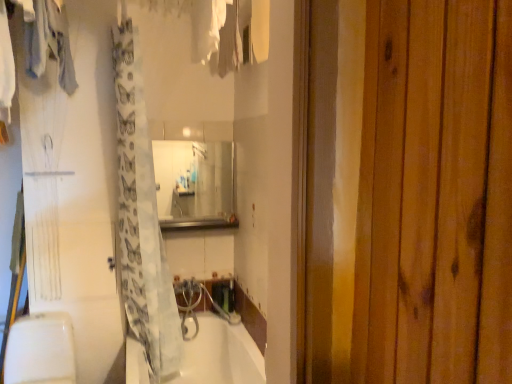
Question: In the image, is translucent white shower curtain at center on the left side or the right side of metallic stainless steel at center?

Choices:
 (A) left
 (B) right

Answer: (A)

Question: Choose the correct answer: Is translucent white shower curtain at center inside metallic stainless steel at center or outside it?

Choices:
 (A) outside
 (B) inside

Answer: (A)

Question: Estimate the real-world distances between objects in this image. Which object is farther from the white glossy bathtub at lower center?

Choices:
 (A) light gray fabric at upper left, acting as the 2th clothing starting from the right
 (B) clear glass mirror at center
 (C) metallic stainless steel at center
 (D) white fabric at upper center, which appears as the 1th clothing when viewed from the right
 (E) translucent white shower curtain at center

Answer: (D)

Question: Considering the real-world distances, which object is closest to the clear glass mirror at center?

Choices:
 (A) translucent white shower curtain at center
 (B) white glossy bathtub at lower center
 (C) white fabric at upper center, which appears as the 1th clothing when viewed from the right
 (D) light gray fabric at upper left, acting as the 2th clothing starting from the right
 (E) metallic stainless steel at center

Answer: (E)